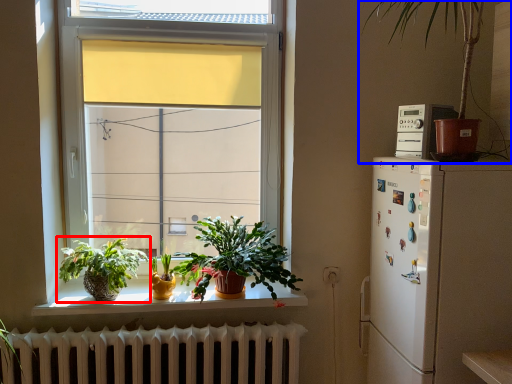
Question: Which object appears closest to the camera in this image, houseplant (highlighted by a red box) or houseplant (highlighted by a blue box)?

Choices:
 (A) houseplant
 (B) houseplant

Answer: (B)